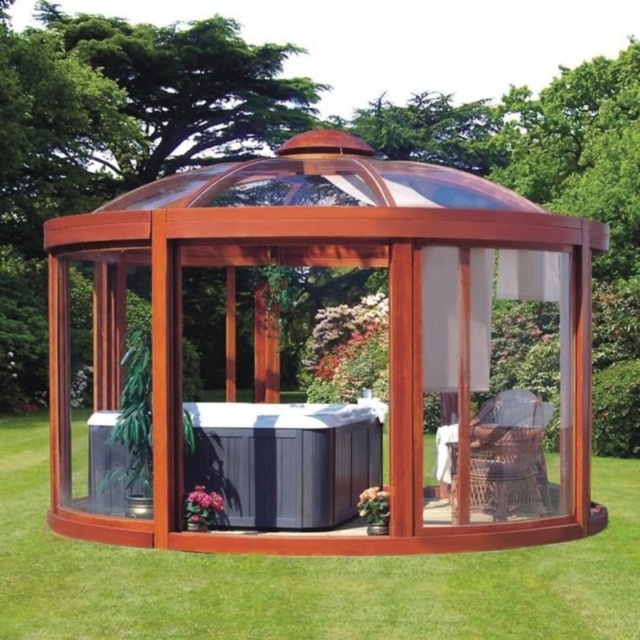
Is wooden gazebo at center closer to the viewer compared to green grass at center?

No, wooden gazebo at center is further to the viewer.

Measure the distance between wooden gazebo at center and green grass at center.

A distance of 86.88 centimeters exists between wooden gazebo at center and green grass at center.

At what (x,y) coordinates should I click in order to perform the action: click on wooden gazebo at center. Please return your answer as a coordinate pair (x, y). Image resolution: width=640 pixels, height=640 pixels. Looking at the image, I should click on (388, 323).

The image size is (640, 640). Identify the location of wooden gazebo at center. (388, 323).